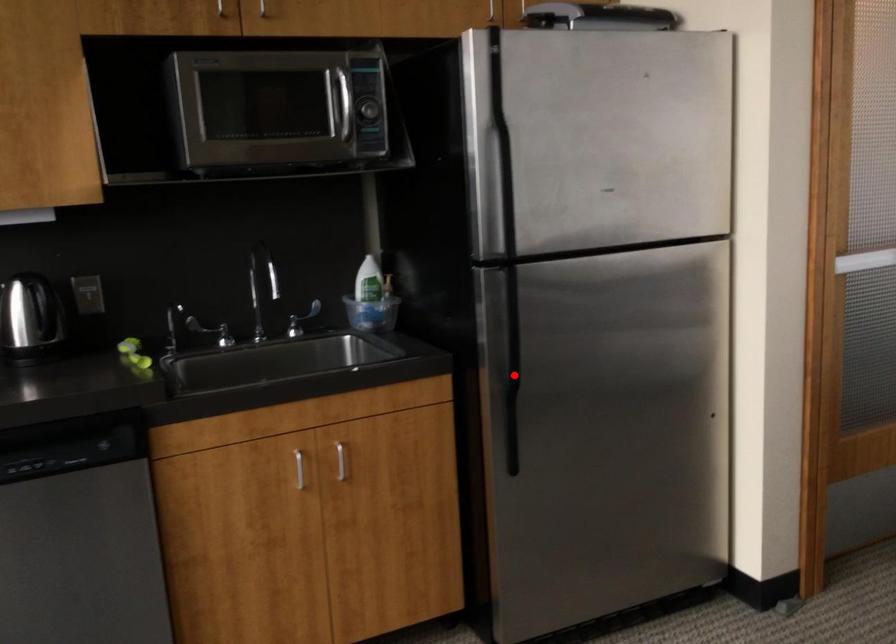
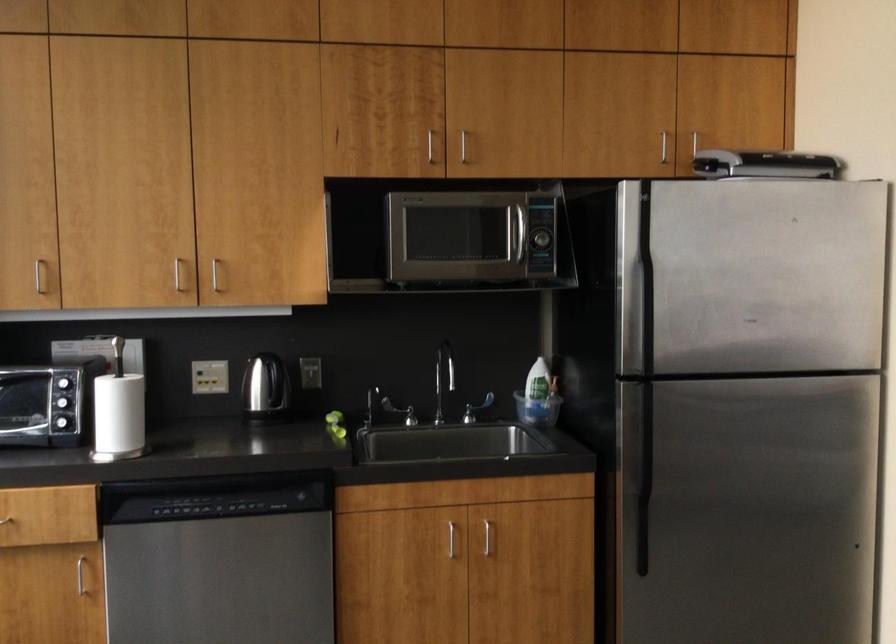
Question: I am providing you with two images of the same scene from different viewpoints. A red point is marked on the first image. Is the red point's position out of view in image 2?

Choices:
 (A) Yes
 (B) No

Answer: (B)